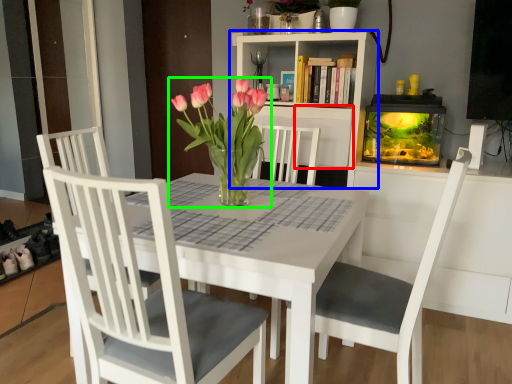
Question: Which object is positioned farthest from shelf (highlighted by a red box)? Select from bookcase (highlighted by a blue box) and houseplant (highlighted by a green box).

Choices:
 (A) bookcase
 (B) houseplant

Answer: (B)